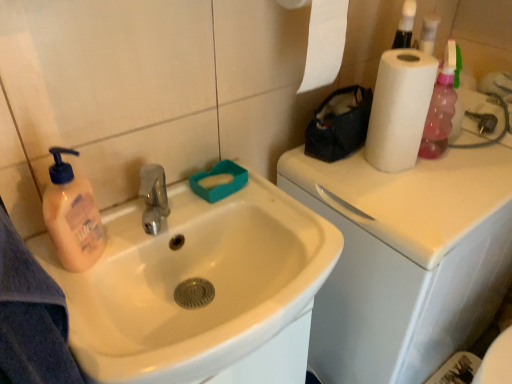
Question: Considering their positions, is white glossy sink at left located in front of or behind white matte paper towel at upper right?

Choices:
 (A) front
 (B) behind

Answer: (A)

Question: Do you think white glossy sink at left is within white matte paper towel at upper right, or outside of it?

Choices:
 (A) inside
 (B) outside

Answer: (B)

Question: Estimate the real-world distances between objects in this image. Which object is farther from the white glossy sink at left?

Choices:
 (A) white glossy counter top at upper right
 (B) white matte paper towel at upper right

Answer: (B)

Question: Which object is the farthest from the white matte paper towel at upper right?

Choices:
 (A) white glossy sink at left
 (B) white glossy counter top at upper right

Answer: (A)